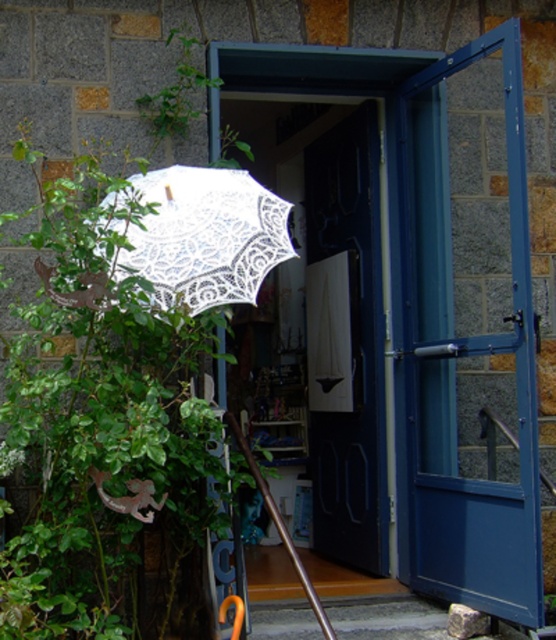
Looking at this image, you are standing outside the entrance and want to enter the shop. To do so, you need to pass through the blue glass door at right. However, the white lace umbrella at left is in your way. Can you move around the umbrella to reach the door?

The blue glass door at right is located below the white lace umbrella at left, so you can move around the umbrella to reach the door since it is positioned lower and not blocking the path directly above.

You are a delivery person trying to enter the shop through the blue glass door at right. The white lace umbrella at left is blocking your path. Can you walk around the umbrella to reach the door?

The blue glass door at right is larger than the white lace umbrella at left, so there is enough space to walk around the umbrella and reach the door.

You are a painter standing in front of the blue glass door at right and the white lace umbrella at left. You want to paint both objects but need to know which one is taller. Which object should you focus on first if you want to start with the taller one?

The blue glass door at right has a greater height compared to the white lace umbrella at left, so you should focus on painting the blue glass door at right first since it is taller.